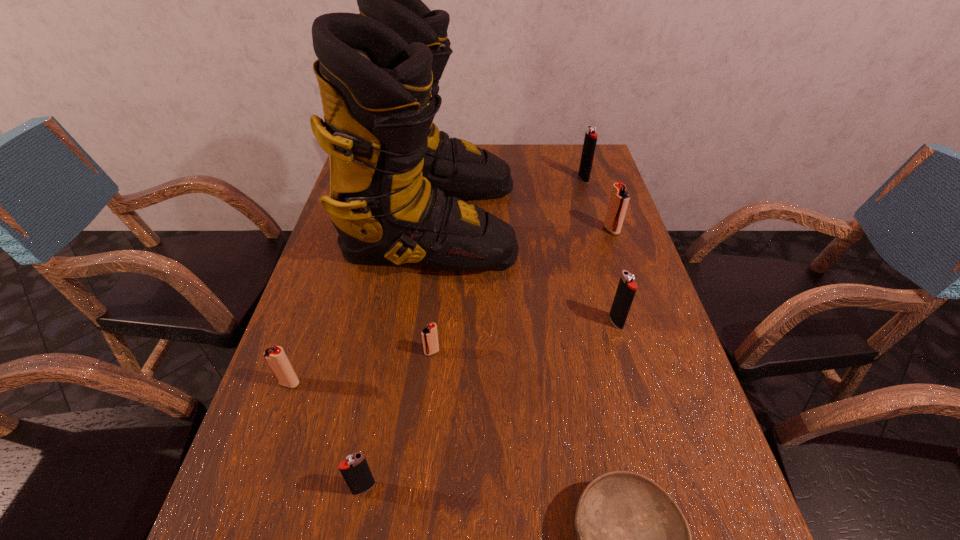
Find the location of a particular element. the leftmost red igniter is located at coordinates (275, 356).

Where is `the second farthest red igniter`? This screenshot has width=960, height=540. the second farthest red igniter is located at coordinates (429, 335).

Identify the location of the second red igniter from left to right. The width and height of the screenshot is (960, 540). (429, 335).

Where is `vacant space located on the front of the ski boots`? The width and height of the screenshot is (960, 540). vacant space located on the front of the ski boots is located at coordinates (412, 400).

Identify the location of vacant area located 0.250m on the front of the farthest igniter. The height and width of the screenshot is (540, 960). (600, 232).

This screenshot has width=960, height=540. What are the coordinates of `vacant space located 0.260m on the back of the farthest red igniter` in the screenshot? It's located at (593, 176).

Locate an element on the screen. This screenshot has height=540, width=960. vacant region located 0.050m on the right of the second farthest black igniter is located at coordinates (643, 321).

I want to click on free region located on the right of the leftmost black igniter, so click(570, 488).

Locate an element on the screen. Image resolution: width=960 pixels, height=540 pixels. vacant space located 0.230m on the right of the fifth farthest igniter is located at coordinates (411, 383).

Identify the location of blank space located 0.100m on the back of the third nearest igniter. (436, 313).